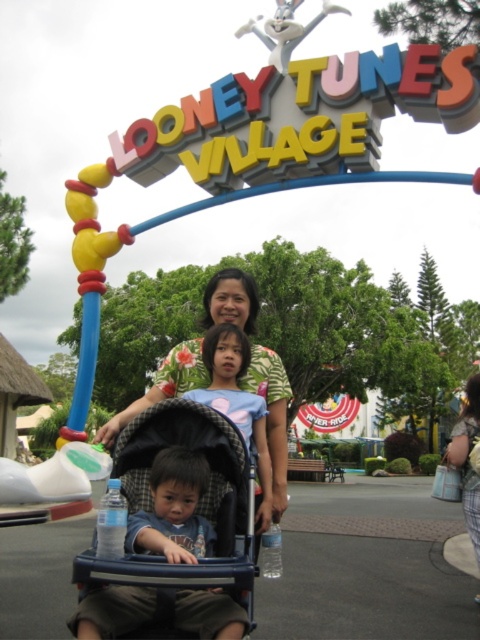
Question: Is blue denim shirt at center smaller than floral shirt at center?

Choices:
 (A) no
 (B) yes

Answer: (B)

Question: Is blue plastic baby carriage at center closer to camera compared to floral shirt at center?

Choices:
 (A) no
 (B) yes

Answer: (B)

Question: Is floral print shirt at center further to the viewer compared to blue denim shirt at center?

Choices:
 (A) no
 (B) yes

Answer: (B)

Question: Which of the following is the closest to the observer?

Choices:
 (A) blue plastic baby carriage at center
 (B) floral shirt at center

Answer: (A)

Question: Which of the following is the closest to the observer?

Choices:
 (A) (462, 419)
 (B) (232, 324)

Answer: (B)

Question: Based on their relative distances, which object is farther from the blue denim shirt at center?

Choices:
 (A) floral print shirt at center
 (B) blue plastic baby carriage at center

Answer: (B)